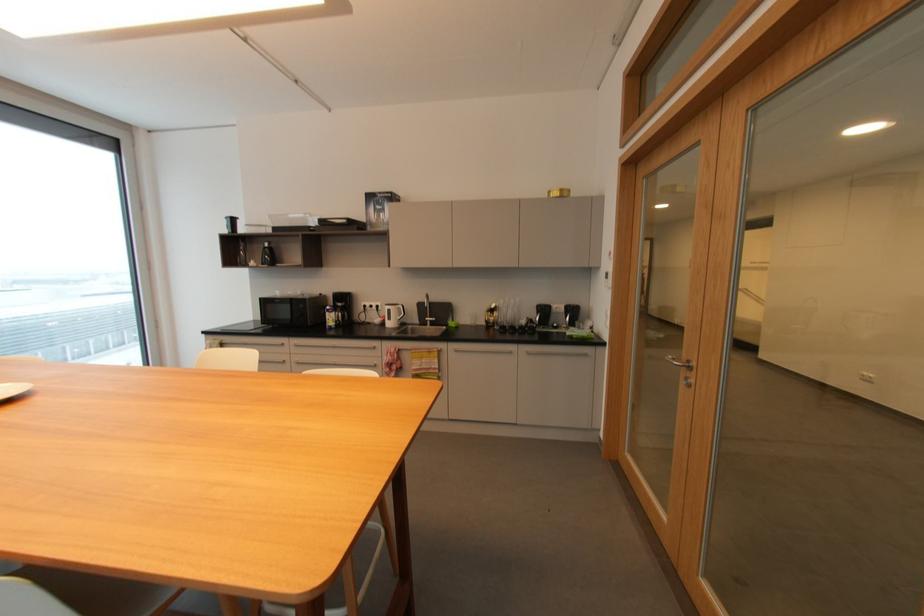
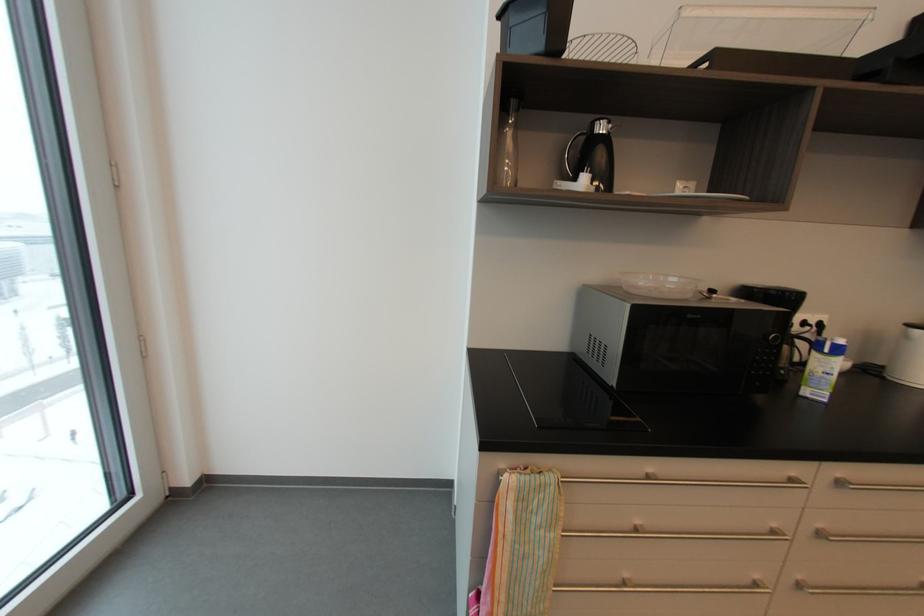
Which direction would the cameraman need to move to produce the second image?

The cameraman moved toward left, forward.